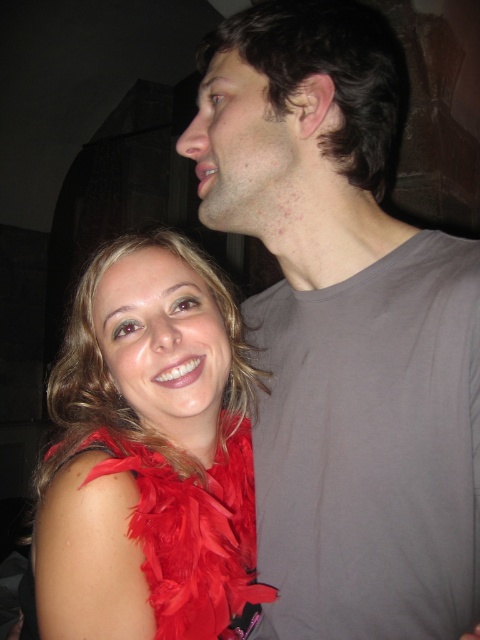
Which is in front, point (226, 112) or point (116, 324)?

Point (226, 112) is more forward.

Can you confirm if gray matte t-shirt at upper right is positioned to the left of feather boa at left?

No, gray matte t-shirt at upper right is not to the left of feather boa at left.

Image resolution: width=480 pixels, height=640 pixels. I want to click on gray matte t-shirt at upper right, so click(344, 328).

The width and height of the screenshot is (480, 640). I want to click on gray matte t-shirt at upper right, so click(x=344, y=328).